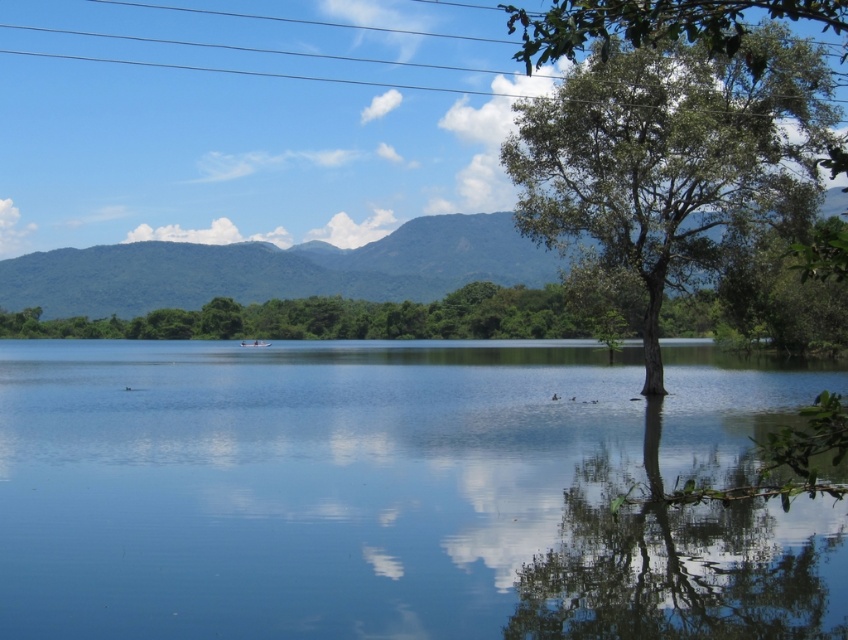
Question: Which of the following is the farthest from the observer?

Choices:
 (A) transparent water at center
 (B) green leafy tree at right

Answer: (A)

Question: Considering the real-world distances, which object is farthest from the green leafy mountain at center?

Choices:
 (A) green leafy tree at right
 (B) transparent water at center

Answer: (B)

Question: Can you confirm if green leafy tree at right is positioned below green leafy mountain at center?

Choices:
 (A) yes
 (B) no

Answer: (B)

Question: Can you confirm if green leafy tree at right is positioned above green leafy mountain at center?

Choices:
 (A) no
 (B) yes

Answer: (B)

Question: Among these objects, which one is farthest from the camera?

Choices:
 (A) green leafy tree at right
 (B) green leafy mountain at center

Answer: (B)

Question: Can you confirm if transparent water at center is positioned to the right of green leafy mountain at center?

Choices:
 (A) yes
 (B) no

Answer: (A)